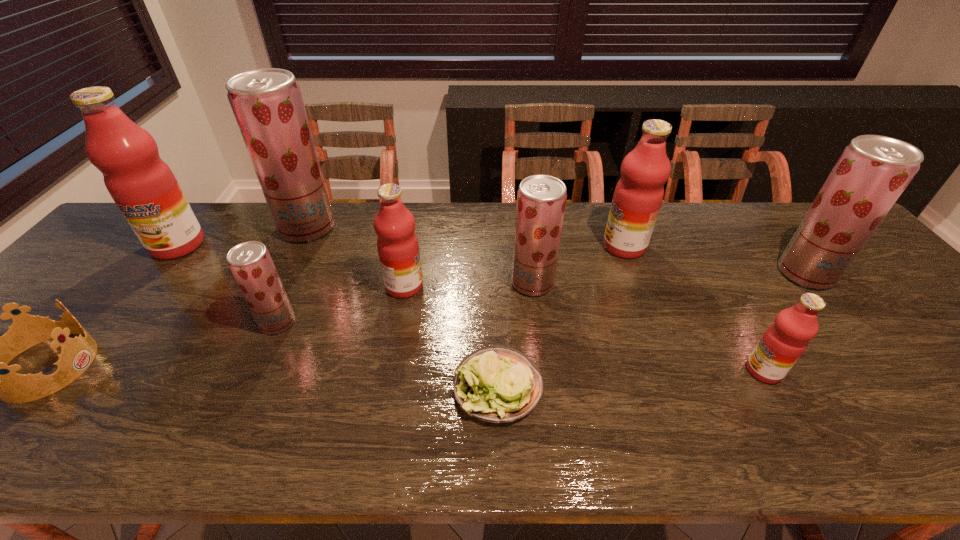
Locate an element on the screen. Image resolution: width=960 pixels, height=540 pixels. unoccupied area between the leftmost pink fruit juice and the farthest strawberry fruit juice is located at coordinates (x=243, y=237).

Locate an element on the screen. free space between the lettuce and the smallest strawberry fruit juice is located at coordinates (388, 355).

Where is `free point between the seventh farthest fruit juice and the third biggest strawberry fruit juice`? The width and height of the screenshot is (960, 540). free point between the seventh farthest fruit juice and the third biggest strawberry fruit juice is located at coordinates (405, 303).

Where is `vacant point located between the rightmost object and the smallest strawberry fruit juice`? The width and height of the screenshot is (960, 540). vacant point located between the rightmost object and the smallest strawberry fruit juice is located at coordinates (541, 298).

Where is `unoccupied area between the farthest strawberry fruit juice and the shortest object`? unoccupied area between the farthest strawberry fruit juice and the shortest object is located at coordinates (402, 307).

The height and width of the screenshot is (540, 960). Identify the location of vacant space in between the second object from right to left and the biggest strawberry fruit juice. (536, 299).

Find the location of a particular element. This screenshot has height=540, width=960. the ninth closest object to the ninth tallest object is located at coordinates (872, 172).

Locate which object is the second closest to the rightmost fruit juice. Please provide its 2D coordinates. Your answer should be formatted as a tuple, i.e. [(x, y)], where the tuple contains the x and y coordinates of a point satisfying the conditions above.

[(638, 195)]

The width and height of the screenshot is (960, 540). Identify the location of fruit juice that can be found as the seventh closest to the rightmost pink fruit juice. (143, 186).

Locate which fruit juice ranks fourth in proximity to the second pink fruit juice from left to right. Please provide its 2D coordinates. Your answer should be formatted as a tuple, i.e. [(x, y)], where the tuple contains the x and y coordinates of a point satisfying the conditions above.

[(638, 195)]